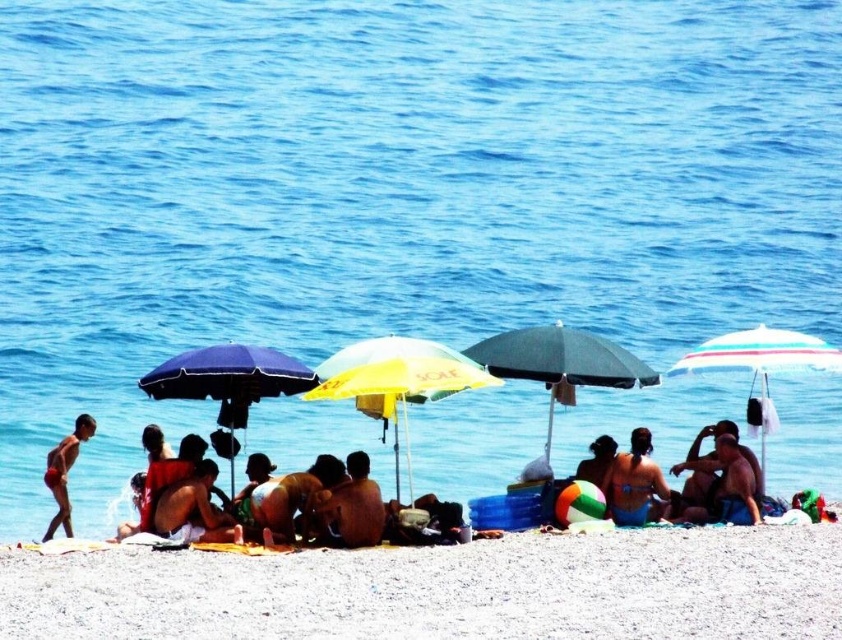
Question: Which point is closer to the camera?

Choices:
 (A) matte blue bikini at center
 (B) matte red swim trunks at left

Answer: (B)

Question: Which object appears farthest from the camera in this image?

Choices:
 (A) matte skin man at center
 (B) blue fabric umbrella at center left

Answer: (A)

Question: From the image, what is the correct spatial relationship of matte red swim trunks at left in relation to smooth tan skin at lower center?

Choices:
 (A) above
 (B) below

Answer: (B)

Question: Observing the image, what is the correct spatial positioning of matte skin man at center in reference to smooth tan skin at lower center?

Choices:
 (A) right
 (B) left

Answer: (A)

Question: Among these objects, which one is farthest from the camera?

Choices:
 (A) matte skin man at center
 (B) yellow fabric umbrella at center
 (C) green matte umbrella at center
 (D) smooth tan skin at lower center

Answer: (D)

Question: Is yellow fabric umbrella at center wider than beige fabric towel at center?

Choices:
 (A) yes
 (B) no

Answer: (A)